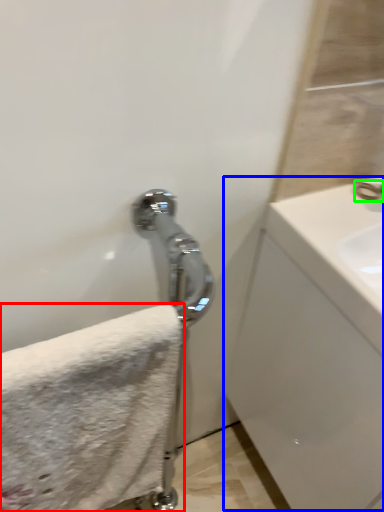
Question: Considering the real-world distances, which object is farthest from towel (highlighted by a red box)? counter top (highlighted by a blue box) or faucet (highlighted by a green box)?

Choices:
 (A) counter top
 (B) faucet

Answer: (B)